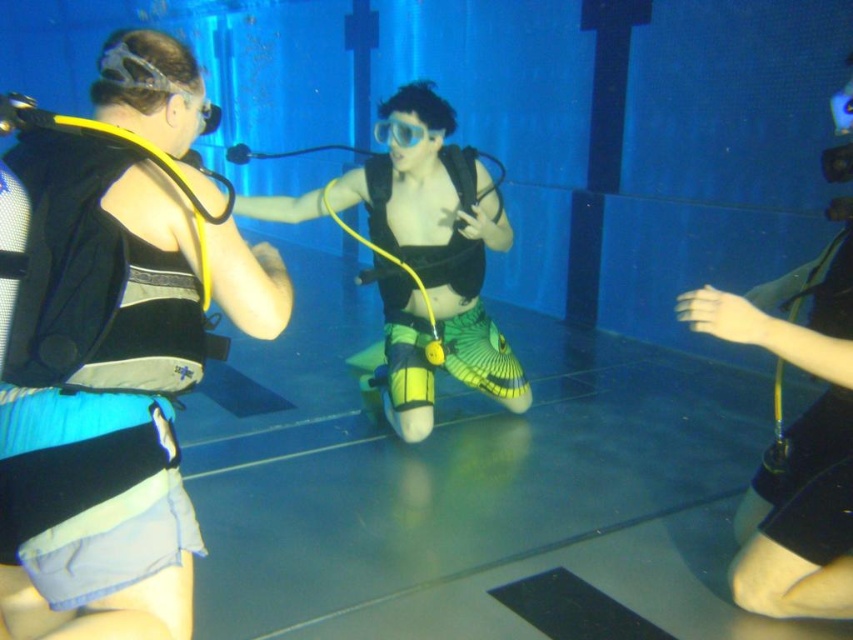
Question: Is blue mesh vest at left bigger than neon green fabric fins at center?

Choices:
 (A) yes
 (B) no

Answer: (B)

Question: Can you confirm if neon green fabric fins at center is wider than transparent plastic goggles at center?

Choices:
 (A) yes
 (B) no

Answer: (A)

Question: Which of the following is the closest to the observer?

Choices:
 (A) (47, 483)
 (B) (428, 392)
 (C) (404, 140)

Answer: (A)

Question: Which point appears closest to the camera in this image?

Choices:
 (A) (405, 134)
 (B) (459, 189)
 (C) (126, 60)

Answer: (C)

Question: Among these points, which one is nearest to the camera?

Choices:
 (A) (102, 406)
 (B) (375, 131)

Answer: (A)

Question: Does neon green fabric fins at center appear under transparent plastic goggles at center?

Choices:
 (A) no
 (B) yes

Answer: (B)